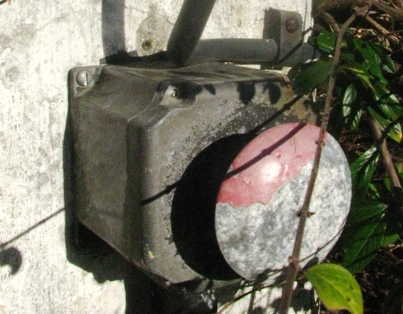
Locate an element on the screen. metal clip securing thick black power line to the wall of a concrete structure is located at coordinates (289, 42).